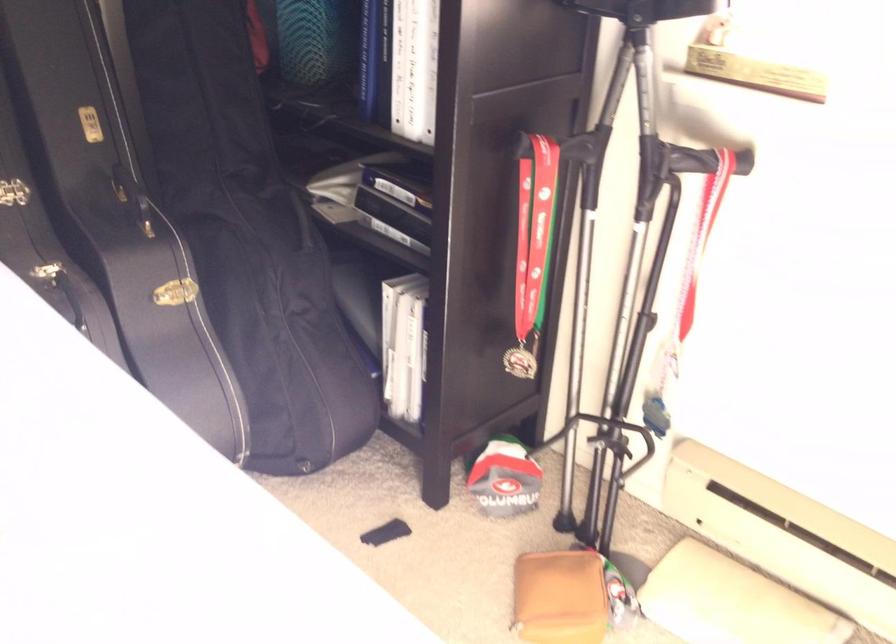
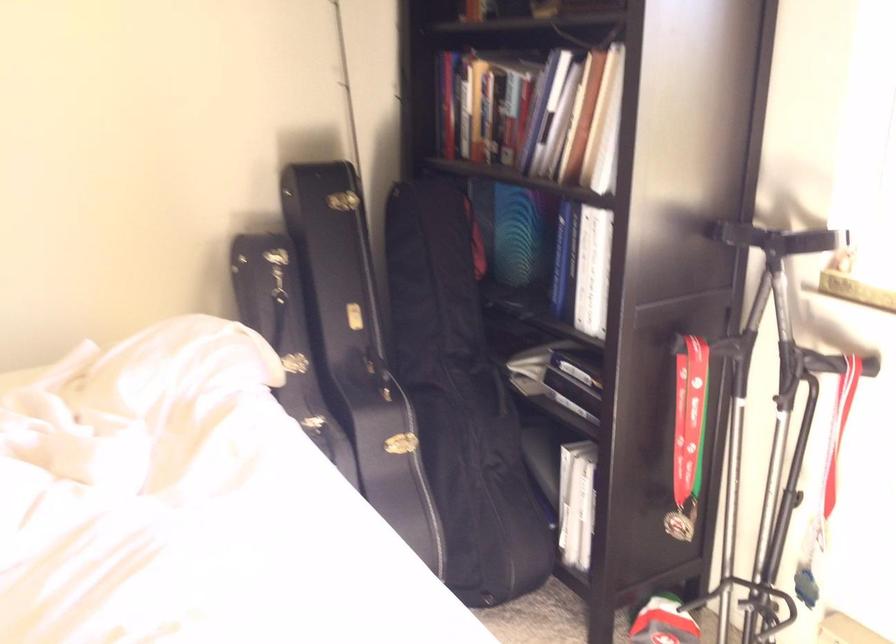
In the second image, find the point that corresponds to (x=613, y=225) in the first image.

(764, 413)